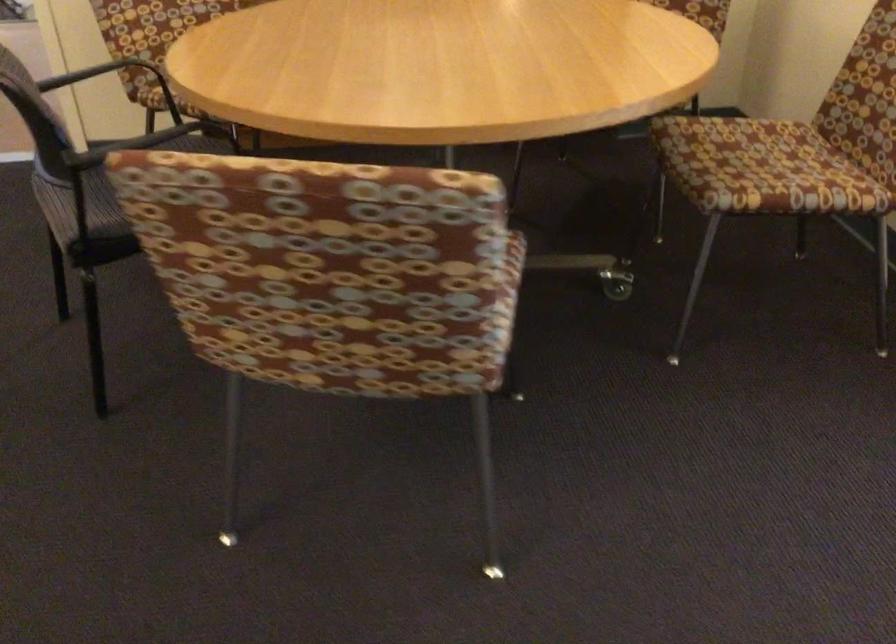
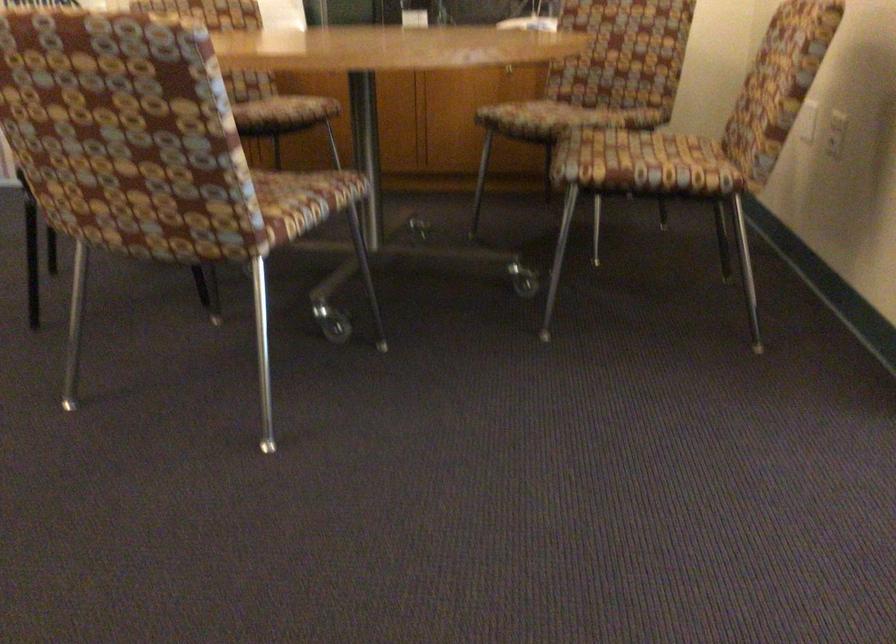
Locate, in the second image, the point that corresponds to (x=487, y=307) in the first image.

(289, 204)